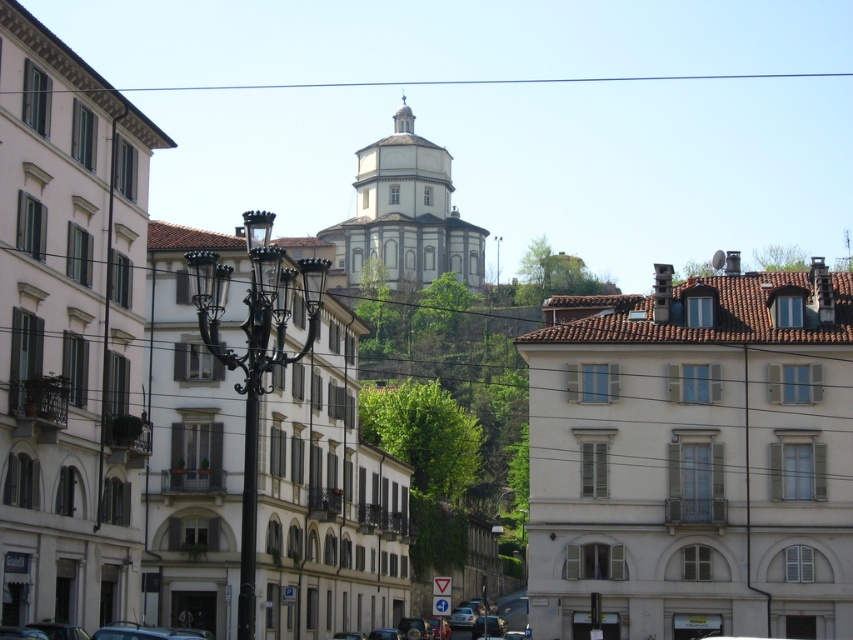
Question: Can you confirm if white smooth dome at center is bigger than metallic silver car at center?

Choices:
 (A) no
 (B) yes

Answer: (B)

Question: From the image, what is the correct spatial relationship of white tiled roof at upper center in relation to metallic silver car at center?

Choices:
 (A) left
 (B) right

Answer: (B)

Question: Is white tiled roof at upper center bigger than white marble church at center?

Choices:
 (A) yes
 (B) no

Answer: (B)

Question: Which object is the farthest from the white smooth dome at center?

Choices:
 (A) metallic silver car at center
 (B) white tiled roof at upper center

Answer: (B)

Question: Considering the real-world distances, which object is closest to the white tiled roof at upper center?

Choices:
 (A) white smooth dome at center
 (B) metallic silver car at center
 (C) white marble church at center

Answer: (C)

Question: Which point is closer to the camera?

Choices:
 (A) (369, 240)
 (B) (399, 492)
 (C) (621, 593)
 (D) (461, 627)

Answer: (C)